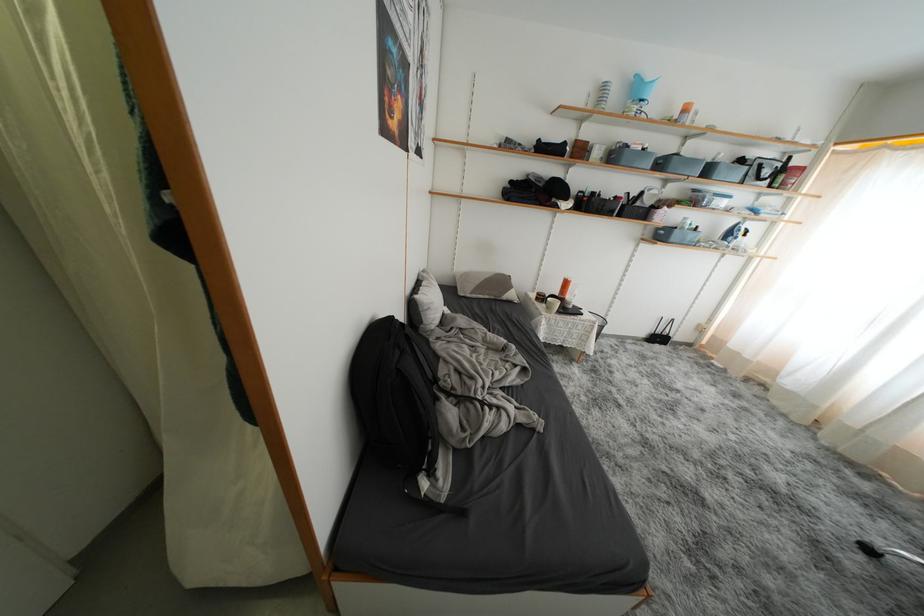
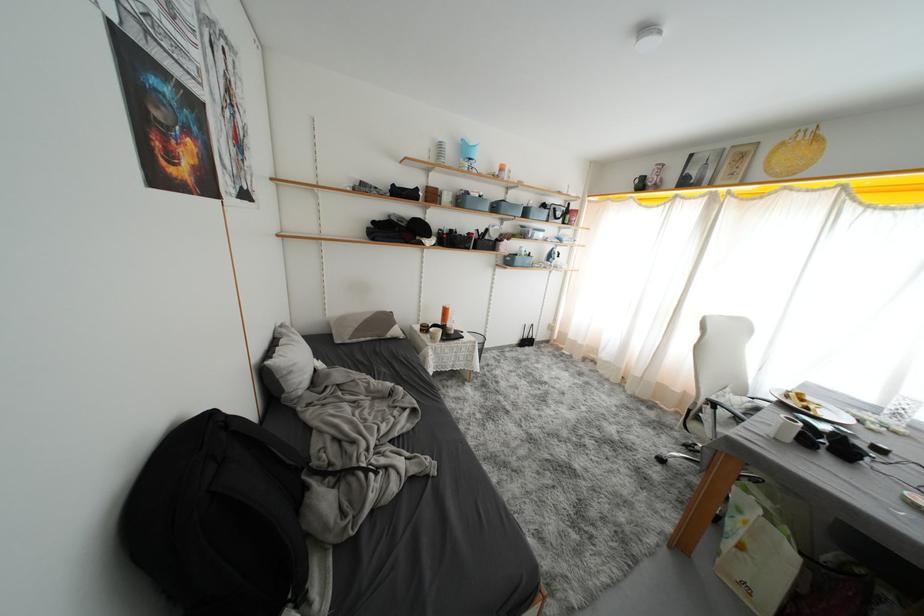
Question: The first image is from the beginning of the video and the second image is from the end. How did the camera likely rotate when shooting the video?

Choices:
 (A) Left
 (B) Right
 (C) Up
 (D) Down

Answer: (B)